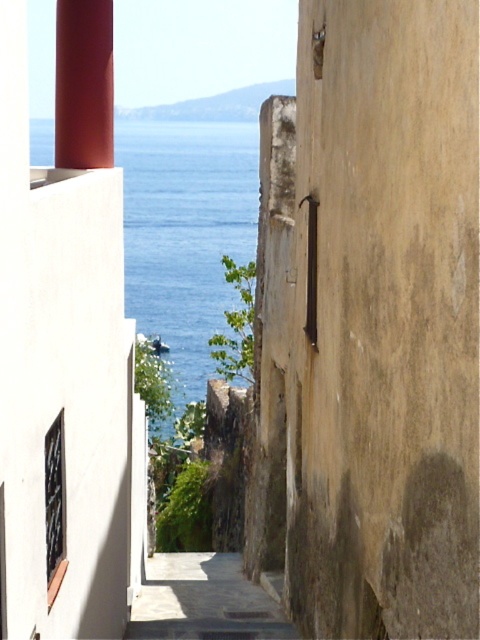
You are a delivery person trying to navigate through the narrow alleyway between the beige wall on the right and the white building with a red column on the left. You need to pass through the alley to reach the blue water at center. Considering the smooth concrete pillar at center, will it block your path if you drive a 2.5 meter wide delivery truck straight ahead?

The smooth concrete pillar at center has a lesser width compared to blue water at center. Since the pillar is narrower than the blue water area, it should not block the truck. However, the exact width of the pillar isn t specified, so caution is advised. If the truck is 2.5 meters wide and the pillar is narrower, there might be enough space to pass safely as long as the truck stays centered. But without knowing the exact dimensions, it s risky. The safest option would be to avoid driving the truck through.

You are standing in the alleyway between the beige wall on the right and the white building with a red column on the left. There is a point marked at coordinates (372, 321). What object is located at that point?

At point (372, 321) lies a smooth concrete pillar at center.

You are standing in the alleyway and want to take a photo of the blue water at center. The smooth concrete pillar at center is blocking your view. Can you move to the side to avoid the pillar and still see the water?

The smooth concrete pillar at center is closer to the viewer than blue water at center, so moving to the side might allow you to see around the pillar and still capture the blue water at center in your photo.